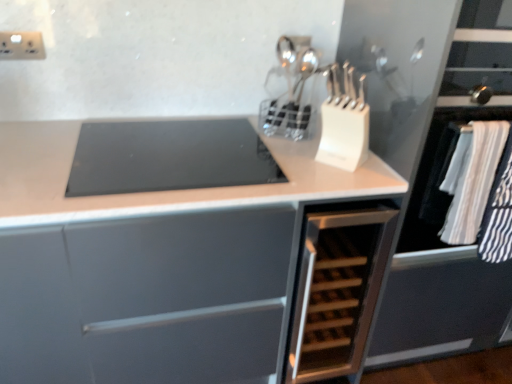
Where is `vacant area situated below black glass cooktop at center (from a real-world perspective)`? The height and width of the screenshot is (384, 512). vacant area situated below black glass cooktop at center (from a real-world perspective) is located at coordinates (162, 145).